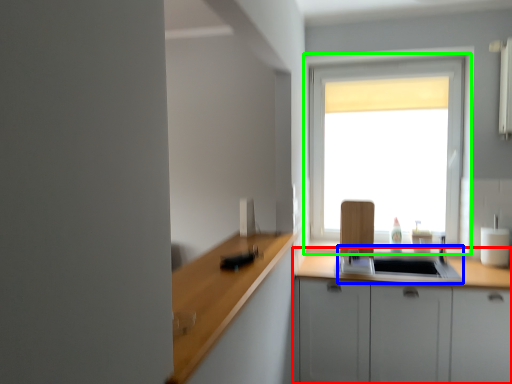
Question: Estimate the real-world distances between objects in this image. Which object is closer to cabinetry (highlighted by a red box), sink (highlighted by a blue box) or window (highlighted by a green box)?

Choices:
 (A) sink
 (B) window

Answer: (A)